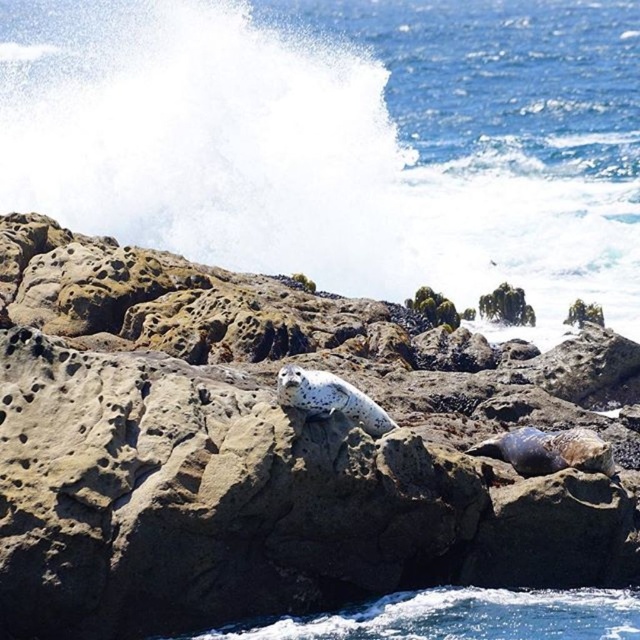
You are a photographer standing on the coast and want to capture both the speckled gray rock at center and the blue water at upper center in your shot. Based on their positions, which object will appear closer to the camera in your photo?

The speckled gray rock at center appears closer to the camera because it is positioned in front of the blue water at upper center.

You are a photographer standing on a cliff overlooking the coastal scene. You want to capture a photo of the speckled gray rock at center and the blue water at upper center in the same frame. Based on their distance apart, will you be able to include both in a single shot without moving your position?

The speckled gray rock at center is 29.79 meters away from the blue water at upper center. Since both objects are within the same coastal scene and positioned in the frame, you can capture both in a single shot without moving your position as they are already in the same visual plane.

Looking at this image, you are a photographer standing at the edge of the coastal rocks. You want to take a photo of the blue water at upper center without the speckled gray rock at center blocking the view. Is the rock currently blocking the water in the photo?

The speckled gray rock at center is positioned under the blue water at upper center, so it is blocking the view of the water in the photo.